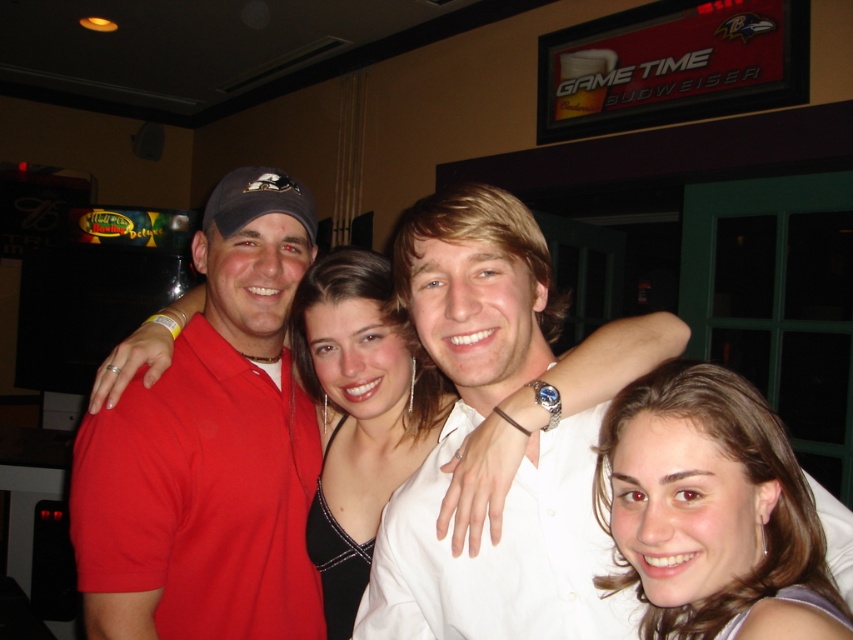
You are a photographer at the event and need to adjust the lighting to ensure both the brown hair at center and the satin black dress at center are well illuminated. Since the dress is longer than the hair, where should you position the light source to avoid shadows on the dress?

The brown hair at center is shorter than the satin black dress at center. To avoid shadows on the dress, position the light source above the dress so that the longer dress does not cast a shadow over the shorter hair.

You are a photographer standing at the camera position. You want to adjust the focus to capture the matte red polo shirt at center clearly. Given that the camera has a depth of field of 3 feet, will the other people in the image be in focus as well?

The matte red polo shirt at center is 3.72 feet away from the camera. Since the depth of field is 3 feet, the focus range would be from approximately 3.72 feet minus 1.5 feet to 3.72 feet plus 1.5 feet, which is 2.22 to 5.22 feet. The other people are positioned closely together, so if they are within this range, they would also be in focus. However, without exact distances, it is uncertain. But since they are all posing closely, it is likely they are within the depth of field and thus in focus.

You are a photographer at the event and want to ensure that both the brown hair at center and the satin black dress at center are clearly visible in the photo. Given their sizes, which one might require more careful framing to avoid being overshadowed?

The brown hair at center has a smaller size compared to the satin black dress at center, so the brown hair at center might require more careful framing to avoid being overshadowed.